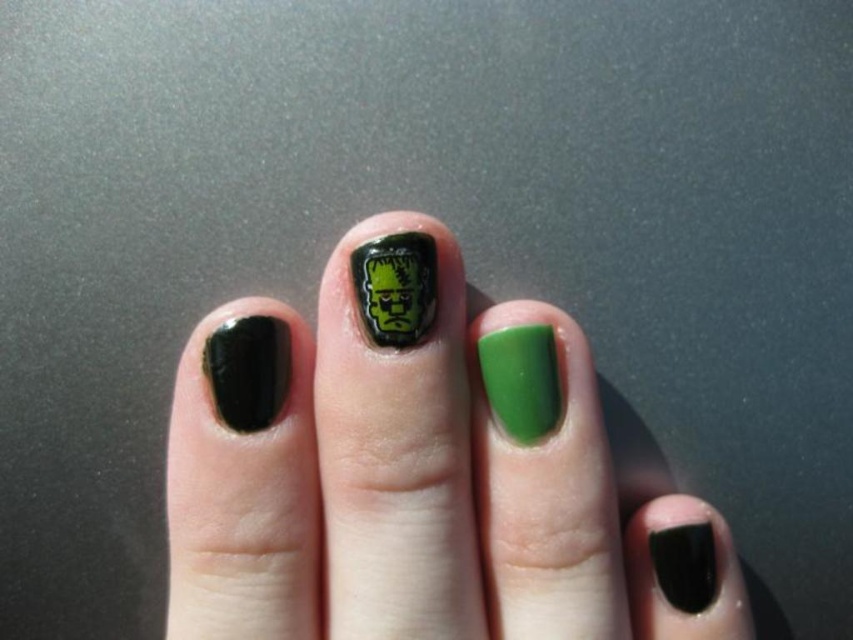
Is matte black nail art at center shorter than black matte nail polish at center left?

Incorrect, matte black nail art at center's height does not fall short of black matte nail polish at center left's.

This screenshot has width=853, height=640. What do you see at coordinates (413, 492) in the screenshot?
I see `matte black nail art at center` at bounding box center [413, 492].

Image resolution: width=853 pixels, height=640 pixels. What do you see at coordinates (413, 492) in the screenshot?
I see `matte black nail art at center` at bounding box center [413, 492].

Locate an element on the screen. This screenshot has height=640, width=853. matte black nail art at center is located at coordinates (413, 492).

Is point (250, 428) positioned before point (705, 560)?

Yes, it is.

Is black matte nail polish at center left taller than matte black nail polish at lower right?

Yes, black matte nail polish at center left is taller than matte black nail polish at lower right.

Is point (231, 356) behind point (701, 596)?

No, it is in front of (701, 596).

Where is `black matte nail polish at center left`? This screenshot has width=853, height=640. black matte nail polish at center left is located at coordinates (248, 371).

Is point (410, 330) positioned in front of point (659, 561)?

Yes, it is in front of point (659, 561).

Does glossy green frankenstein nail art at center have a greater width compared to matte black nail polish at lower right?

Indeed, glossy green frankenstein nail art at center has a greater width compared to matte black nail polish at lower right.

The image size is (853, 640). Describe the element at coordinates (395, 288) in the screenshot. I see `glossy green frankenstein nail art at center` at that location.

Locate an element on the screen. This screenshot has height=640, width=853. glossy green frankenstein nail art at center is located at coordinates (395, 288).